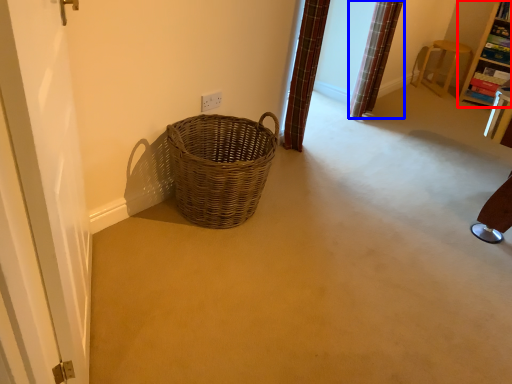
Question: Which of the following is the closest to the observer, furniture (highlighted by a red box) or curtain (highlighted by a blue box)?

Choices:
 (A) furniture
 (B) curtain

Answer: (B)